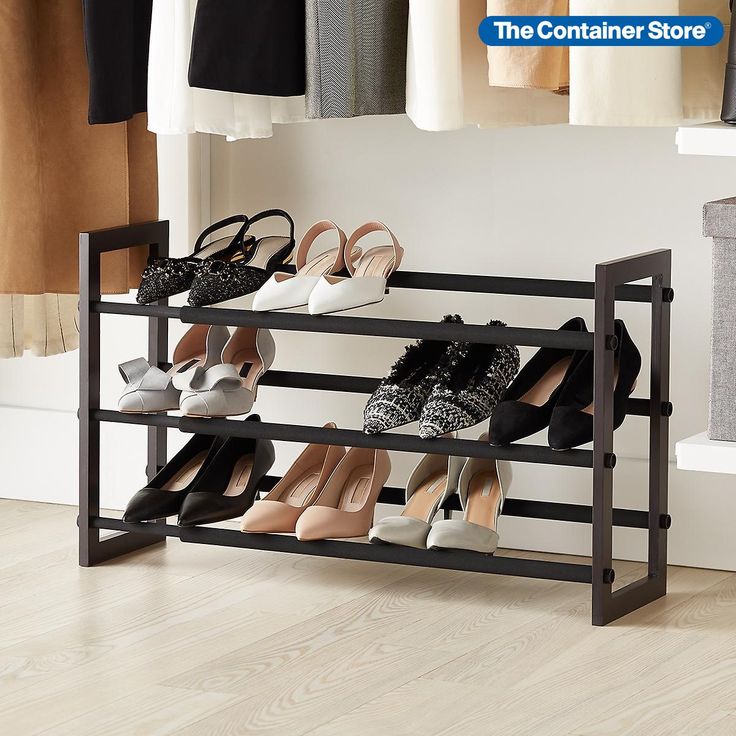
What are the coordinates of `shelf rod` in the screenshot? It's located at (240, 319), (486, 286), (364, 382), (329, 435), (241, 531), (277, 481).